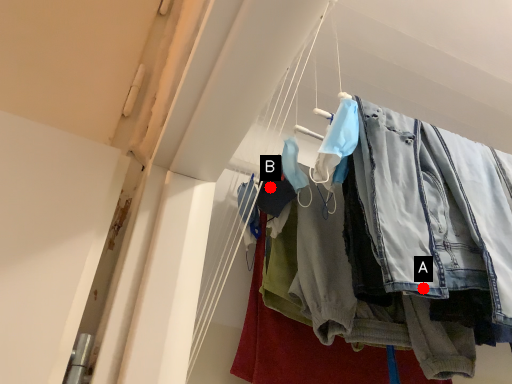
Question: Two points are circled on the image, labeled by A and B beside each circle. Which of the following is the farthest from the observer?

Choices:
 (A) A is further
 (B) B is further

Answer: (B)